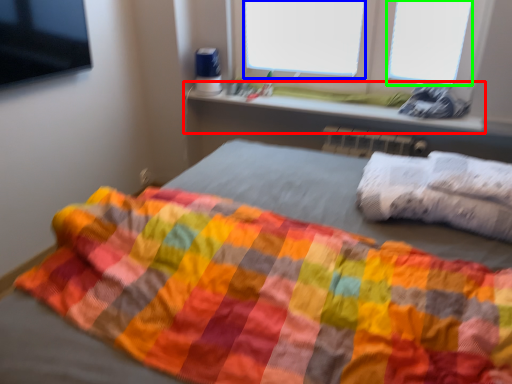
Question: Estimate the real-world distances between objects in this image. Which object is farther from window sill (highlighted by a red box), window screen (highlighted by a blue box) or window screen (highlighted by a green box)?

Choices:
 (A) window screen
 (B) window screen

Answer: (B)